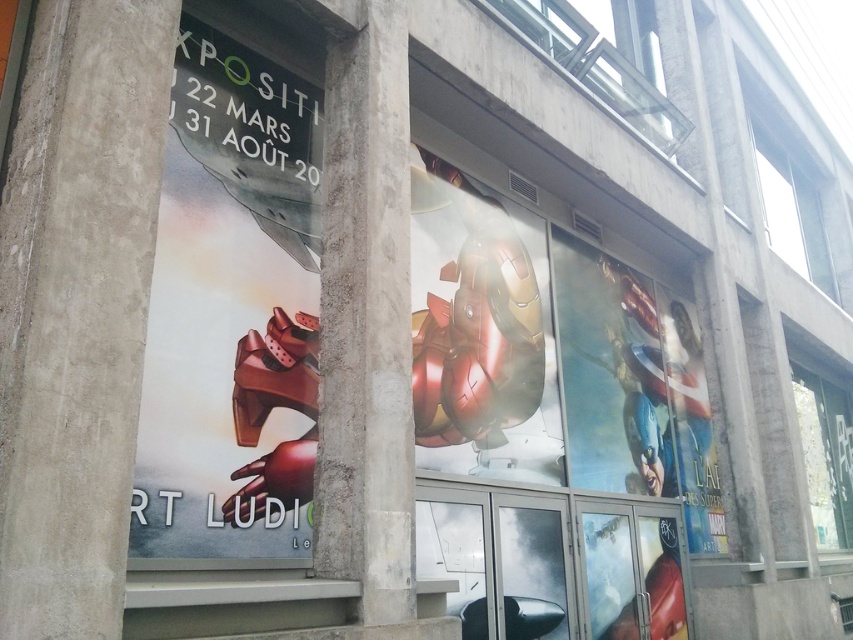
Can you confirm if concrete pillar at center is taller than shiny metallic iron man suit at center?

Yes.

The width and height of the screenshot is (853, 640). Find the location of `concrete pillar at center`. concrete pillar at center is located at coordinates (366, 321).